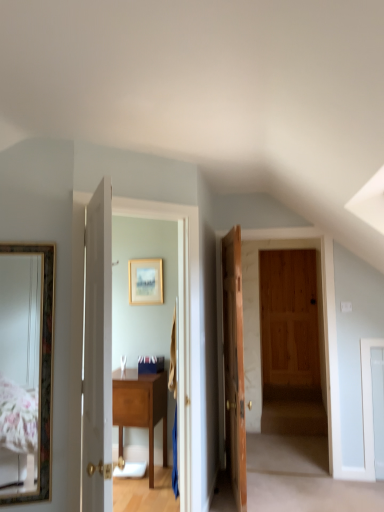
I want to click on vacant area located to the right-hand side of wooden door at center, which appears as the second door when viewed from the front, so click(x=314, y=496).